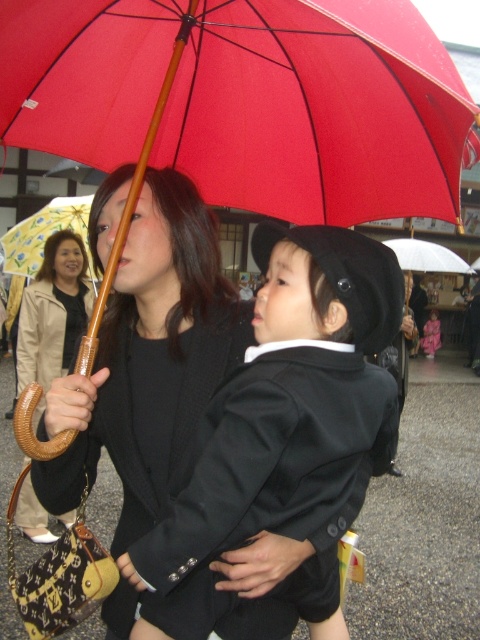
Can you confirm if red fabric umbrella at upper center is shorter than matte black umbrella at upper left?

Yes.

Image resolution: width=480 pixels, height=640 pixels. What are the coordinates of `red fabric umbrella at upper center` in the screenshot? It's located at (244, 100).

The width and height of the screenshot is (480, 640). What do you see at coordinates (244, 100) in the screenshot?
I see `red fabric umbrella at upper center` at bounding box center [244, 100].

In order to click on red fabric umbrella at upper center in this screenshot , I will do `click(244, 100)`.

Can you confirm if red fabric umbrella at upper center is wider than matte black suit at center?

Indeed, red fabric umbrella at upper center has a greater width compared to matte black suit at center.

Can you confirm if red fabric umbrella at upper center is thinner than matte black suit at center?

In fact, red fabric umbrella at upper center might be wider than matte black suit at center.

What do you see at coordinates (244, 100) in the screenshot?
I see `red fabric umbrella at upper center` at bounding box center [244, 100].

In order to click on red fabric umbrella at upper center in this screenshot , I will do `click(244, 100)`.

Which of these two, matte black umbrella at upper left or yellowmaterial/textureumbrella at upper left, stands shorter?

yellowmaterial/textureumbrella at upper left is shorter.

Does matte black umbrella at upper left have a greater height compared to yellowmaterial/textureumbrella at upper left?

Yes, matte black umbrella at upper left is taller than yellowmaterial/textureumbrella at upper left.

Is point (32, 518) positioned after point (28, 218)?

No, (32, 518) is in front of (28, 218).

You are a GUI agent. You are given a task and a screenshot of the screen. Output one action in this format:
    pyautogui.click(x=<x>, y=<y>)
    Task: Click on the matte black umbrella at upper left
    
    Given the screenshot: What is the action you would take?
    pos(52,314)